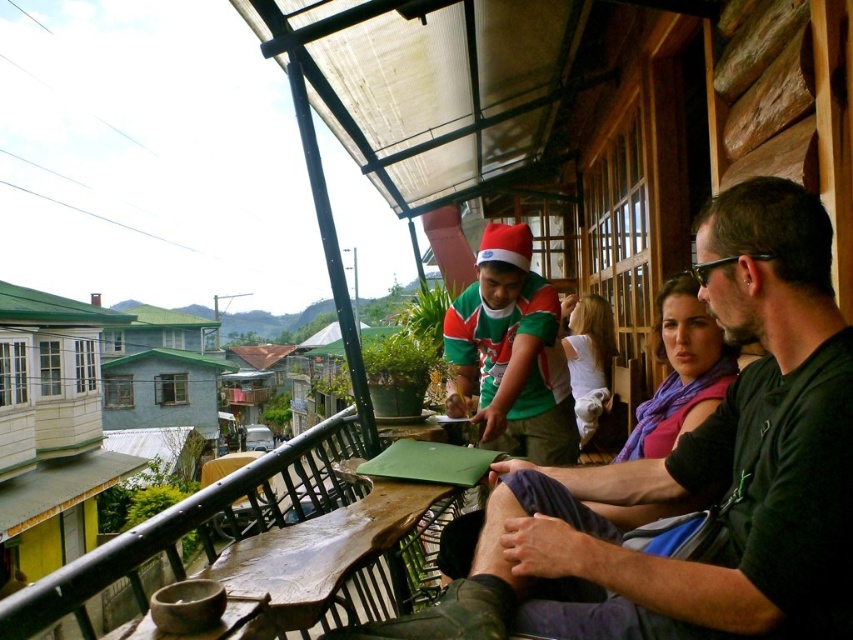
You are standing on the balcony and want to move from the point at coordinates point (825, 314) to the point at coordinates point (538, 362). Which direction should you move to get closer to your destination?

To move from point (825, 314) to point (538, 362), you should move downward and to the right since the destination point is located below and to the right of the starting point.

You are a delivery person who needs to place a small package between the green jersey at center and the green knitted sweater at center on the balcony. The package is 1.2 meters long. Will there be enough space to fit it between them?

The distance between the green jersey at center and the green knitted sweater at center is 1.21 meters. Since the package is 1.2 meters long, there will be enough space to fit it between them as the distance is slightly larger than the package length.